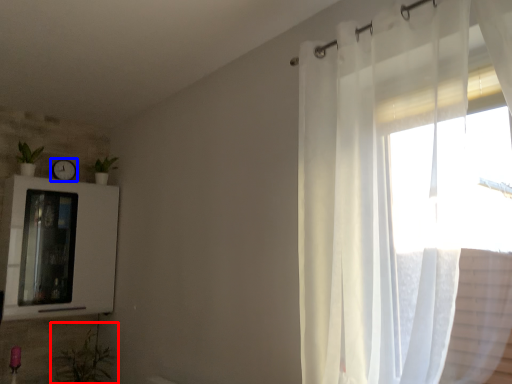
Question: Which of the following is the farthest to the observer, plant (highlighted by a red box) or clock (highlighted by a blue box)?

Choices:
 (A) plant
 (B) clock

Answer: (B)